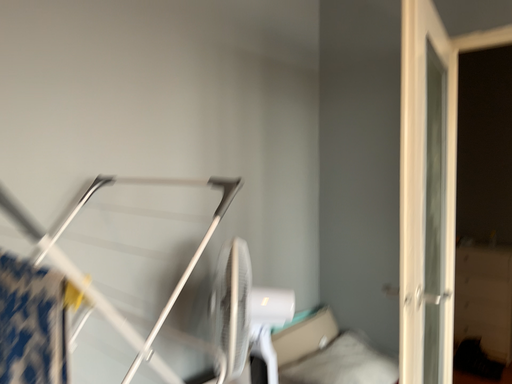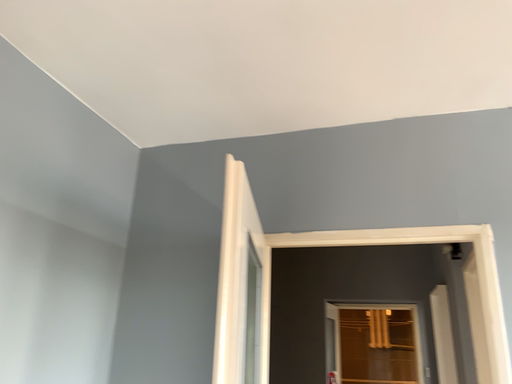
Question: Which way did the camera rotate in the video?

Choices:
 (A) rotated upward
 (B) rotated downward

Answer: (A)